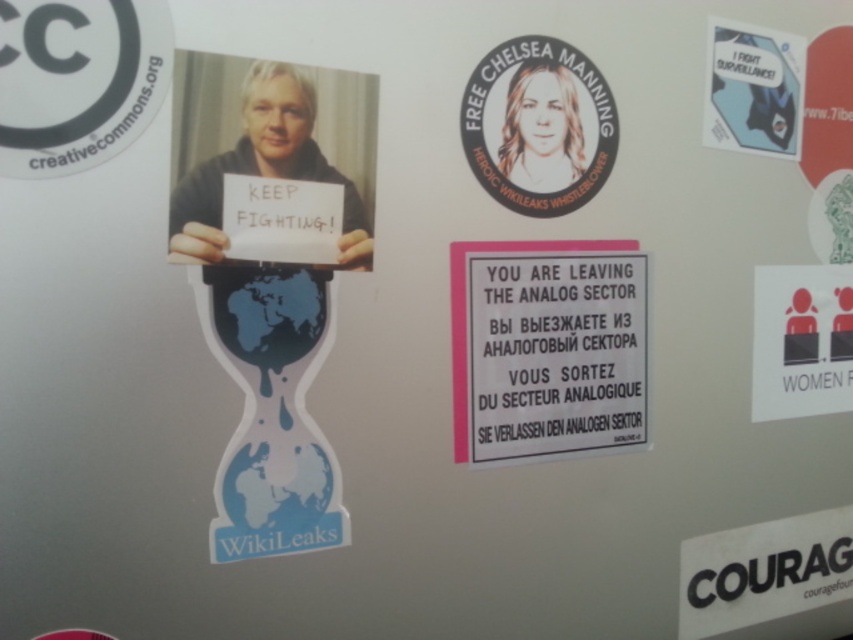
Can you confirm if white paper sign at center is shorter than smooth white portrait at upper center?

No, white paper sign at center is not shorter than smooth white portrait at upper center.

Who is more forward, (647, 321) or (546, 180)?

Point (546, 180)

Which is in front, point (576, 451) or point (526, 188)?

Point (526, 188)

In order to click on white paper sign at center in this screenshot , I will do `click(549, 349)`.

Is point (599, 266) behind point (757, 372)?

No, (599, 266) is closer to viewer.

In the scene shown: Who is positioned more to the right, white paper sign at center or white paper sign at right?

white paper sign at right

Identify the location of white paper sign at center. (549, 349).

Where is `white paper sign at center`? The height and width of the screenshot is (640, 853). white paper sign at center is located at coordinates (549, 349).

Is white paper sign at right smaller than blue glossy sticker at upper right?

Incorrect, white paper sign at right is not smaller in size than blue glossy sticker at upper right.

Which is above, white paper sign at right or blue glossy sticker at upper right?

Positioned higher is blue glossy sticker at upper right.

Who is more forward, (x=808, y=404) or (x=801, y=97)?

Positioned in front is point (x=801, y=97).

In order to click on white paper sign at right in this screenshot , I will do click(x=801, y=340).